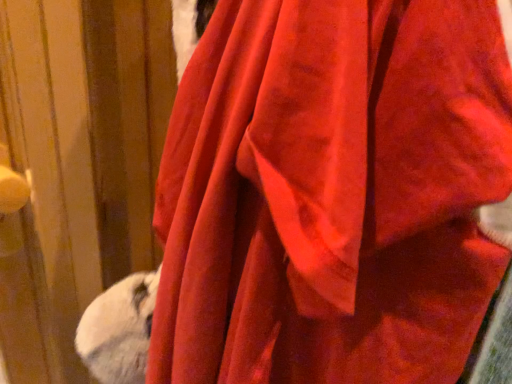
The width and height of the screenshot is (512, 384). What are the coordinates of `velvet red curtain at center` in the screenshot? It's located at (332, 193).

Image resolution: width=512 pixels, height=384 pixels. What do you see at coordinates (332, 193) in the screenshot?
I see `velvet red curtain at center` at bounding box center [332, 193].

Measure the distance between point (270, 230) and camera.

A distance of 27.70 centimeters exists between point (270, 230) and camera.

Image resolution: width=512 pixels, height=384 pixels. I want to click on velvet red curtain at center, so click(x=332, y=193).